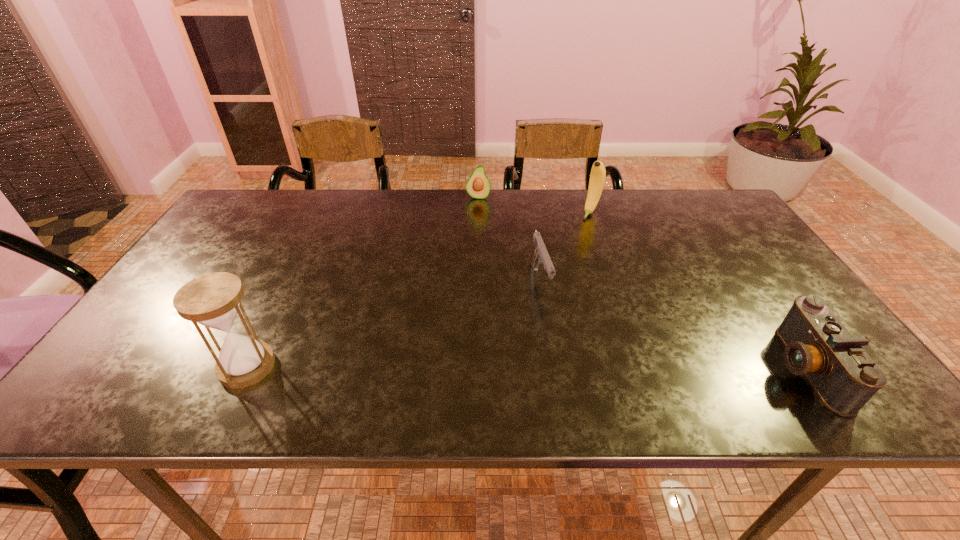
This screenshot has height=540, width=960. I want to click on free space on the desktop that is between the tallest object and the camera and is positioned at the barrel of the pistol, so click(571, 367).

The image size is (960, 540). In order to click on vacant spot on the desktop that is between the tallest object and the camera and is positioned from the stem of the banana in this screenshot , I will do `click(483, 367)`.

The width and height of the screenshot is (960, 540). Identify the location of vacant space on the desktop that is between the tallest object and the rightmost object and is positioned on the cut side of the farthest object. (459, 367).